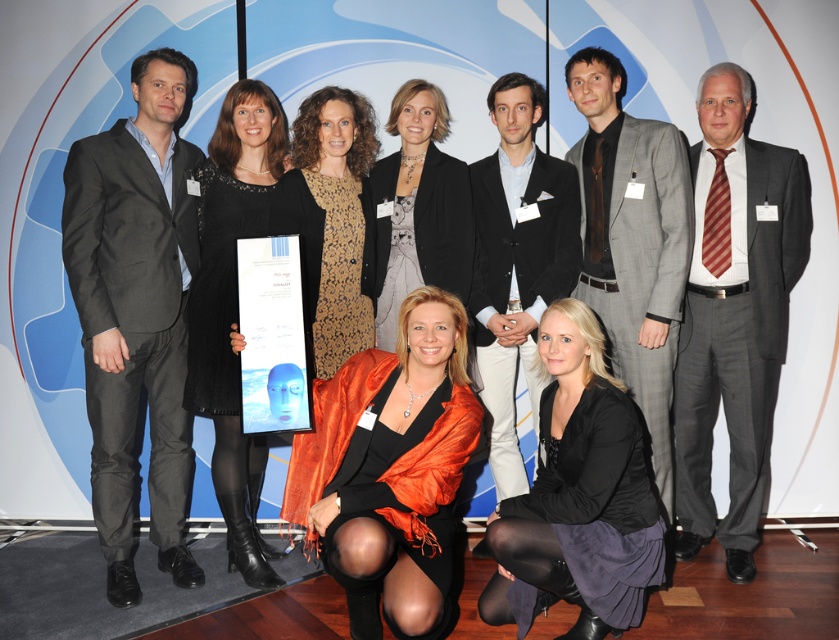
Based on the photo, which is more to the right, satin orange scarf at center or black suit at center?

black suit at center is more to the right.

Between satin orange scarf at center and black suit at center, which one appears on the left side from the viewer's perspective?

satin orange scarf at center

Locate an element on the screen. This screenshot has width=839, height=640. satin orange scarf at center is located at coordinates (389, 468).

This screenshot has height=640, width=839. In order to click on satin orange scarf at center in this screenshot , I will do `click(389, 468)`.

Can you confirm if gray suit at right is positioned below black suit at center?

Yes, gray suit at right is below black suit at center.

From the picture: Who is positioned more to the right, gray suit at right or black suit at center?

Positioned to the right is gray suit at right.

Does point (685, 492) come farther from viewer compared to point (533, 227)?

Yes, point (685, 492) is farther from viewer.

The image size is (839, 640). Identify the location of gray suit at right. [x=733, y=314].

Does satin orange scarf at center come behind matte black dress at center?

No, it is not.

Can you confirm if satin orange scarf at center is positioned to the right of matte black dress at center?

No, satin orange scarf at center is not to the right of matte black dress at center.

Who is more distant from viewer, (402, 602) or (418, 256)?

The point (418, 256) is behind.

The height and width of the screenshot is (640, 839). What are the coordinates of `satin orange scarf at center` in the screenshot? It's located at (389, 468).